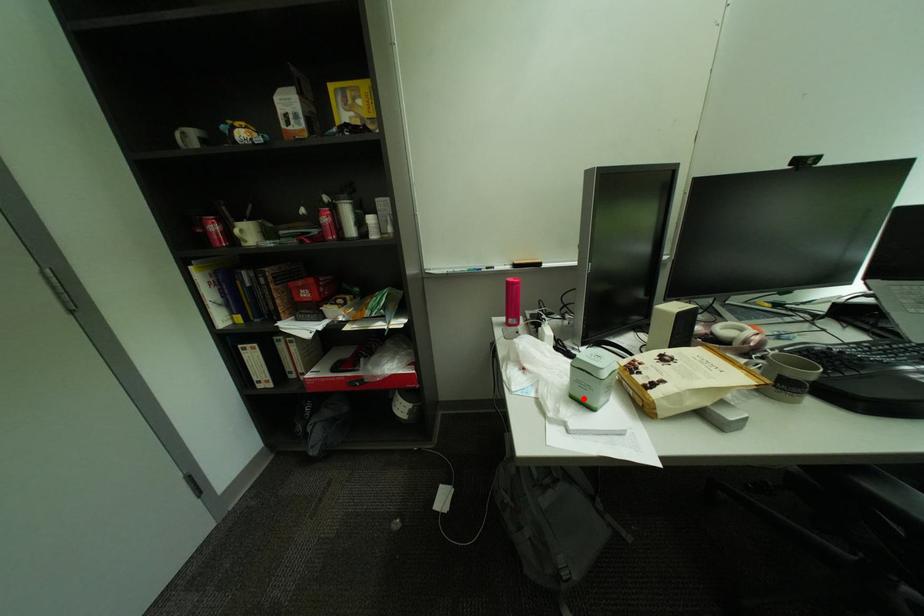
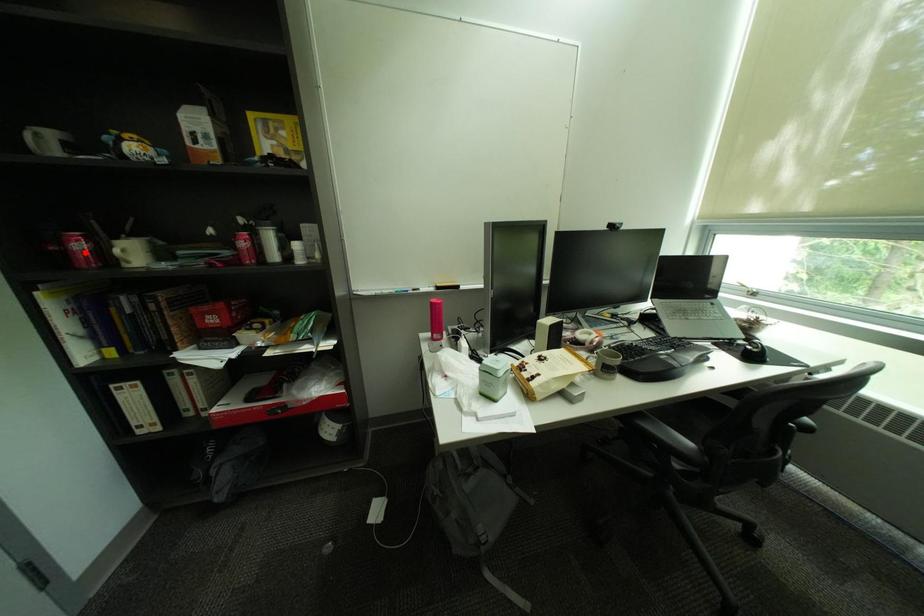
I am providing you with two images of the same scene from different viewpoints. A red point is marked on the first image and another point is marked on the second image. Is the red point in image1 aligned with the point shown in image2?

No